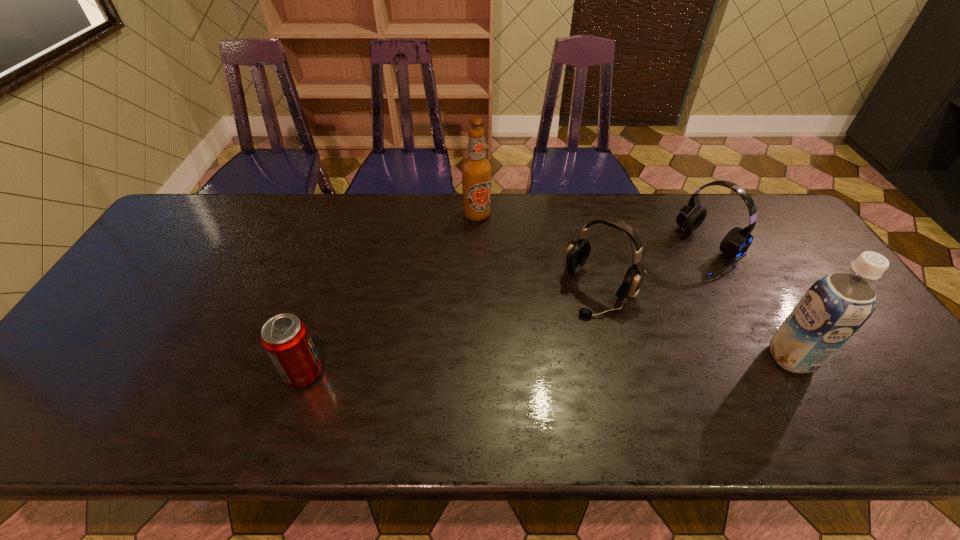
The height and width of the screenshot is (540, 960). Identify the location of soda can. (285, 337).

The width and height of the screenshot is (960, 540). In order to click on the leftmost object in this screenshot , I will do `click(285, 337)`.

Where is `soya milk`? soya milk is located at coordinates (837, 305).

The height and width of the screenshot is (540, 960). In order to click on the right headset in this screenshot , I will do (x=737, y=241).

Find the location of a particular element. This screenshot has width=960, height=540. beer bottle is located at coordinates (476, 170).

Identify the location of the third object from left to right. (x=577, y=253).

Locate an element on the screen. vacant space located on the left of the leftmost object is located at coordinates (191, 373).

Where is `free region located on the label of the soya milk`? This screenshot has width=960, height=540. free region located on the label of the soya milk is located at coordinates (721, 357).

Where is `blank space located 0.260m on the label of the soya milk`? The width and height of the screenshot is (960, 540). blank space located 0.260m on the label of the soya milk is located at coordinates (663, 357).

Locate an element on the screen. Image resolution: width=960 pixels, height=540 pixels. free location located 0.260m on the label of the soya milk is located at coordinates (663, 357).